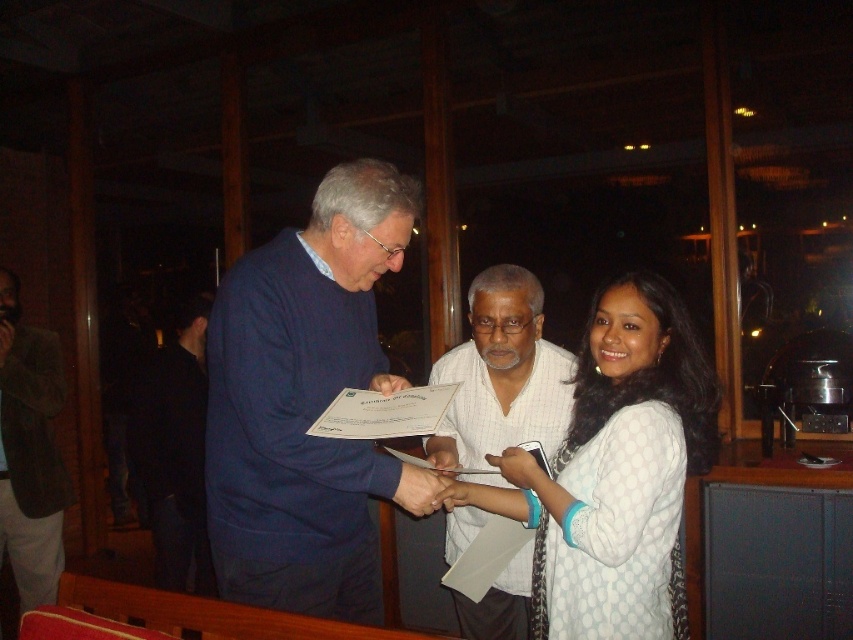
Between white dotted dress at center and dark blue sweater at center, which one is positioned higher?

white dotted dress at center is above.

How much distance is there between white dotted dress at center and dark blue sweater at center?

2.30 meters

Does point (576, 602) come in front of point (0, 506)?

Yes, point (576, 602) is closer to viewer.

Locate an element on the screen. Image resolution: width=853 pixels, height=640 pixels. white dotted dress at center is located at coordinates (614, 472).

Can you confirm if white striped shirt at center is positioned to the left of dark blue sweater at center?

In fact, white striped shirt at center is to the right of dark blue sweater at center.

Is point (489, 392) farther from camera compared to point (4, 460)?

No, it is in front of (4, 460).

The image size is (853, 640). I want to click on white striped shirt at center, so click(502, 374).

Who is lower down, dark blue sweater at center or black fabric shirt at left?

black fabric shirt at left

What do you see at coordinates (28, 451) in the screenshot? This screenshot has width=853, height=640. I see `dark blue sweater at center` at bounding box center [28, 451].

Identify the location of dark blue sweater at center. (28, 451).